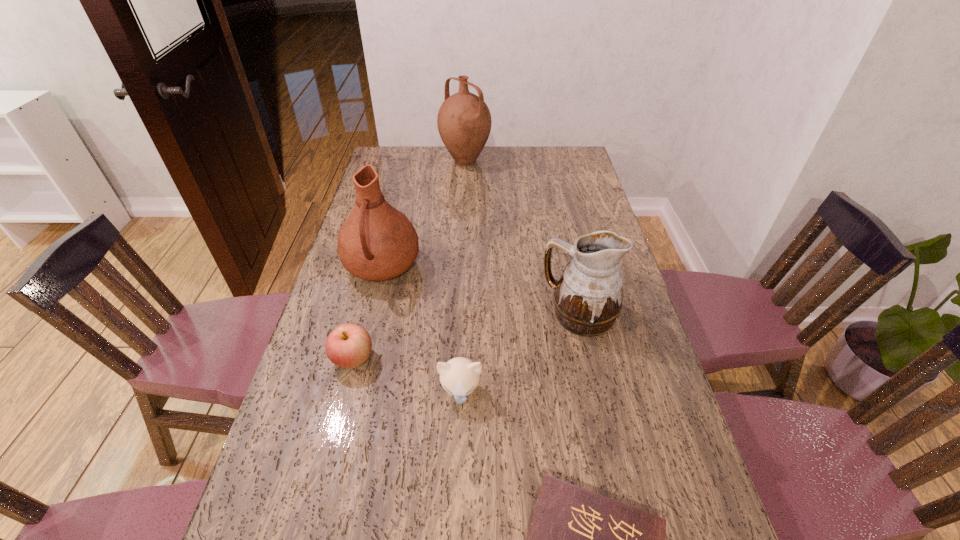
Locate which pitcher ranks in proximity to the farthest object. Please provide its 2D coordinates. Your answer should be formatted as a tuple, i.e. [(x, y)], where the tuple contains the x and y coordinates of a point satisfying the conditions above.

[(376, 242)]

Identify the location of the closest pitcher to the leftmost pitcher. (588, 297).

Identify the location of free spot that satisfies the following two spatial constraints: 1. from the spout of the rightmost pitcher; 2. on the face of the kitten. (596, 392).